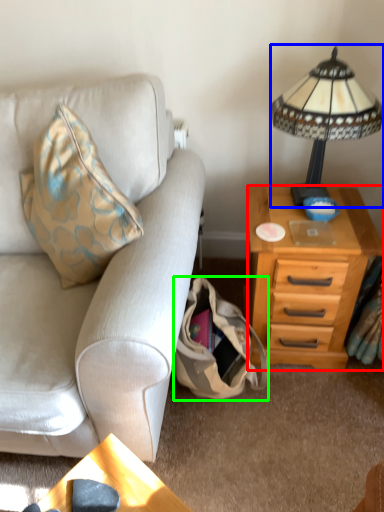
Question: Which object is positioned closest to nightstand (highlighted by a red box)? Select from lamp (highlighted by a blue box) and handbag (highlighted by a green box).

Choices:
 (A) lamp
 (B) handbag

Answer: (B)